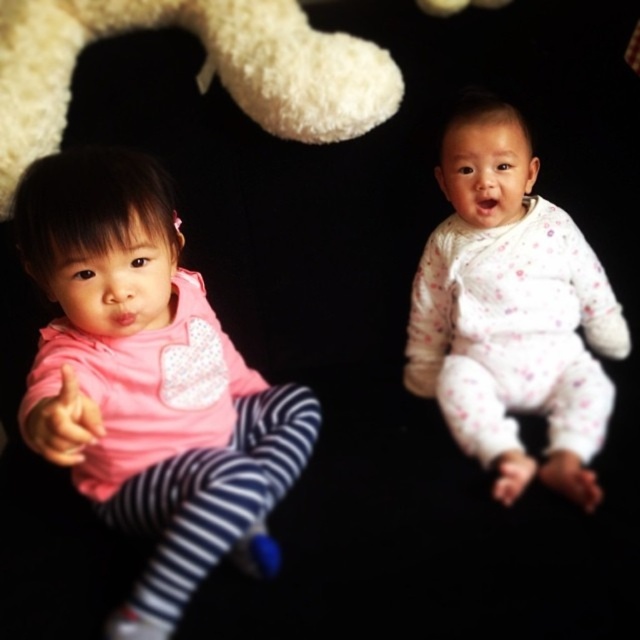
Question: Observing the image, what is the correct spatial positioning of pink fabric shirt at left in reference to white dotted onesie at upper right?

Choices:
 (A) right
 (B) left

Answer: (B)

Question: Can you confirm if pink fabric shirt at left is bigger than white dotted onesie at upper right?

Choices:
 (A) no
 (B) yes

Answer: (B)

Question: Considering the real-world distances, which object is farthest from the pink fabric shirt at left?

Choices:
 (A) white dotted onesie at upper right
 (B) white fluffy teddy bear at upper left

Answer: (A)

Question: Which point is farther from the camera taking this photo?

Choices:
 (A) (252, 381)
 (B) (518, 486)

Answer: (A)

Question: Is pink fabric shirt at left to the right of white fluffy teddy bear at upper left from the viewer's perspective?

Choices:
 (A) no
 (B) yes

Answer: (A)

Question: Which point is farther from the camera taking this photo?

Choices:
 (A) (260, 77)
 (B) (492, 301)
 (C) (205, 516)

Answer: (B)